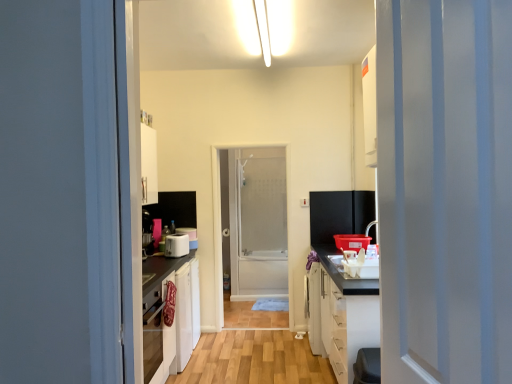
Question: Is white plastic toaster at center, which is counted as the 1th appliance, starting from the back, next to white plastic electric outlet at center and touching it?

Choices:
 (A) yes
 (B) no

Answer: (B)

Question: From a real-world perspective, does white plastic toaster at center, which is the 2th appliance in front-to-back order, stand above white plastic electric outlet at center?

Choices:
 (A) yes
 (B) no

Answer: (B)

Question: Does white plastic toaster at center, which is the 2th appliance in front-to-back order, come behind white plastic electric outlet at center?

Choices:
 (A) yes
 (B) no

Answer: (B)

Question: Can you confirm if white plastic toaster at center, which is counted as the 1th appliance, starting from the back, is shorter than white plastic electric outlet at center?

Choices:
 (A) yes
 (B) no

Answer: (B)

Question: Relative to white plastic toaster at center, which is the 2th appliance in front-to-back order, is frosted glass screen door at center in front or behind?

Choices:
 (A) front
 (B) behind

Answer: (B)

Question: From a real-world perspective, is frosted glass screen door at center positioned above or below white plastic toaster at center, which is counted as the 1th appliance, starting from the back?

Choices:
 (A) above
 (B) below

Answer: (B)

Question: Based on their sizes in the image, would you say frosted glass screen door at center is bigger or smaller than white plastic toaster at center, which is the 2th appliance in front-to-back order?

Choices:
 (A) small
 (B) big

Answer: (B)

Question: Considering the positions of frosted glass screen door at center and white plastic toaster at center, which is the 2th appliance in front-to-back order, in the image, is frosted glass screen door at center taller or shorter than white plastic toaster at center, which is the 2th appliance in front-to-back order,?

Choices:
 (A) tall
 (B) short

Answer: (A)

Question: Considering the positions of point (412, 87) and point (194, 231), is point (412, 87) closer or farther from the camera than point (194, 231)?

Choices:
 (A) farther
 (B) closer

Answer: (B)

Question: From a real-world perspective, is white glossy door at right physically located above or below white plastic toaster at center, which is counted as the 1th appliance, starting from the back?

Choices:
 (A) below
 (B) above

Answer: (B)

Question: Considering their positions, is white glossy door at right located in front of or behind white plastic toaster at center, which is the 2th appliance in front-to-back order?

Choices:
 (A) behind
 (B) front

Answer: (B)

Question: In terms of width, does white glossy door at right look wider or thinner when compared to white plastic toaster at center, which is the 2th appliance in front-to-back order?

Choices:
 (A) thin
 (B) wide

Answer: (A)

Question: From a real-world perspective, relative to wooden floor at center, is white plastic toaster at center, which ranks as the 2th appliance in back-to-front order, vertically above or below?

Choices:
 (A) above
 (B) below

Answer: (A)

Question: Does point (181, 253) appear closer or farther from the camera than point (261, 375)?

Choices:
 (A) farther
 (B) closer

Answer: (A)